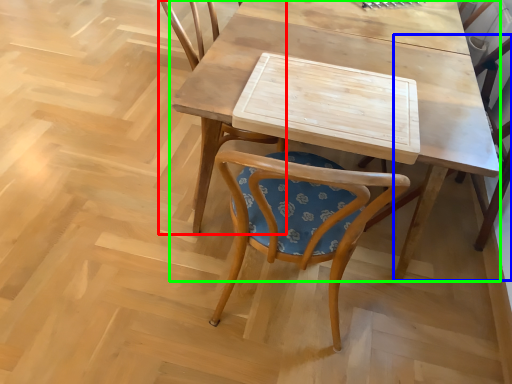
Question: Which object is the farthest from chair (highlighted by a red box)? Choose among these: chair (highlighted by a blue box) or table (highlighted by a green box).

Choices:
 (A) chair
 (B) table

Answer: (A)